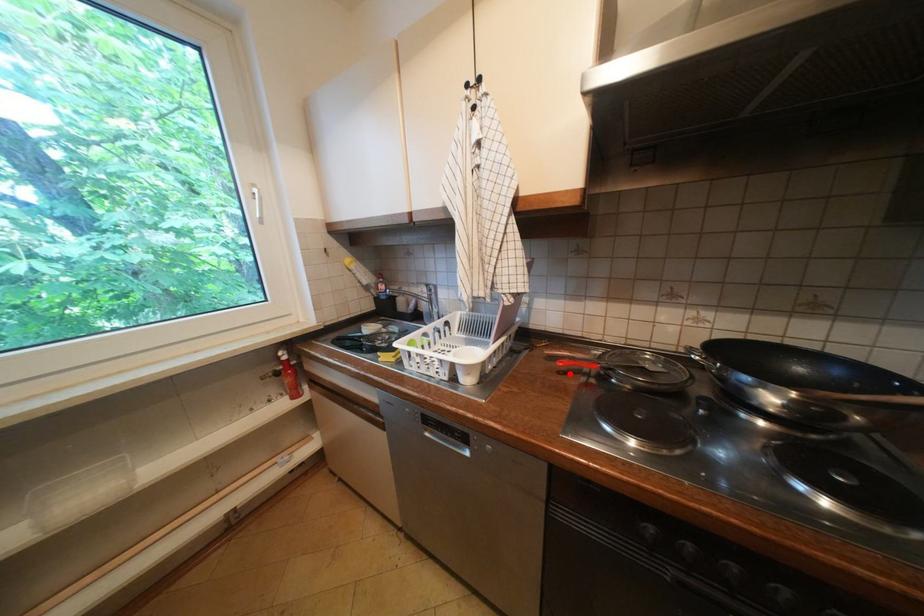
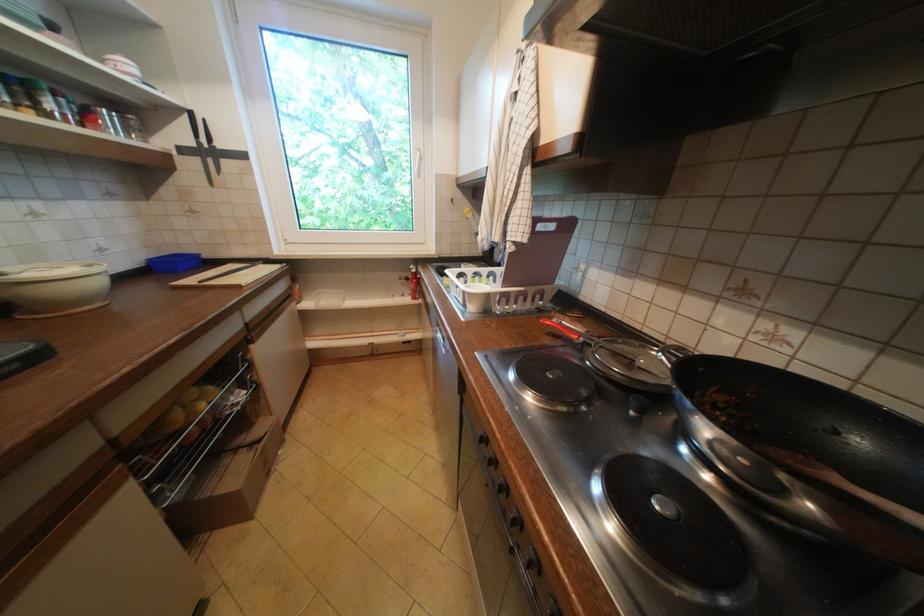
Question: I am providing you with two images of the same scene from different viewpoints. A red point is marked on the first image. At the location where the point appears in image 1, is it still visible in image 2?

Choices:
 (A) Yes
 (B) No

Answer: (A)